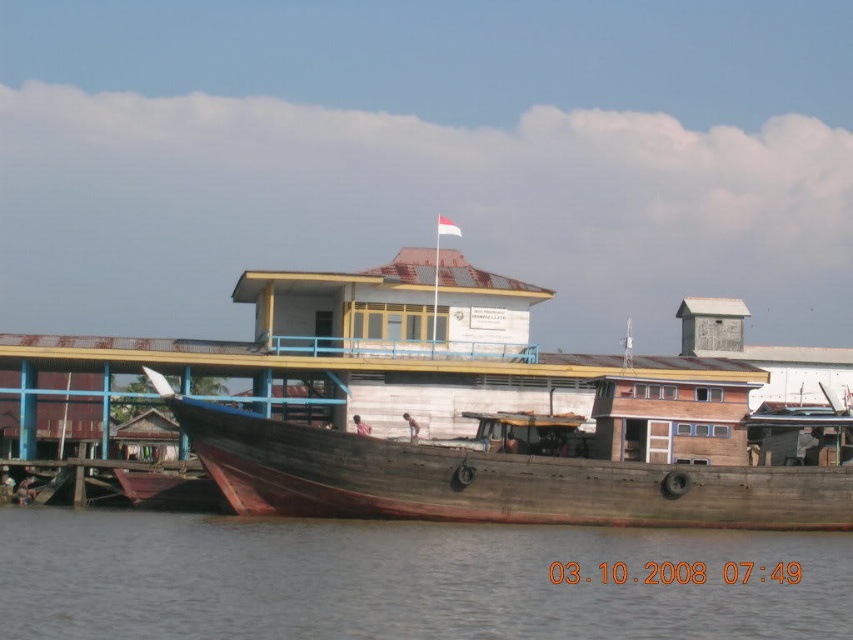
Question: Where is brown water at lower center located in relation to wooden boat at center in the image?

Choices:
 (A) right
 (B) left

Answer: (B)

Question: Which point is closer to the camera taking this photo?

Choices:
 (A) (492, 570)
 (B) (466, 458)

Answer: (A)

Question: Can you confirm if brown water at lower center is wider than wooden boat at center?

Choices:
 (A) no
 (B) yes

Answer: (B)

Question: Can you confirm if brown water at lower center is positioned to the right of wooden boat at center?

Choices:
 (A) no
 (B) yes

Answer: (A)

Question: Which point is closer to the camera?

Choices:
 (A) (74, 545)
 (B) (517, 470)

Answer: (A)